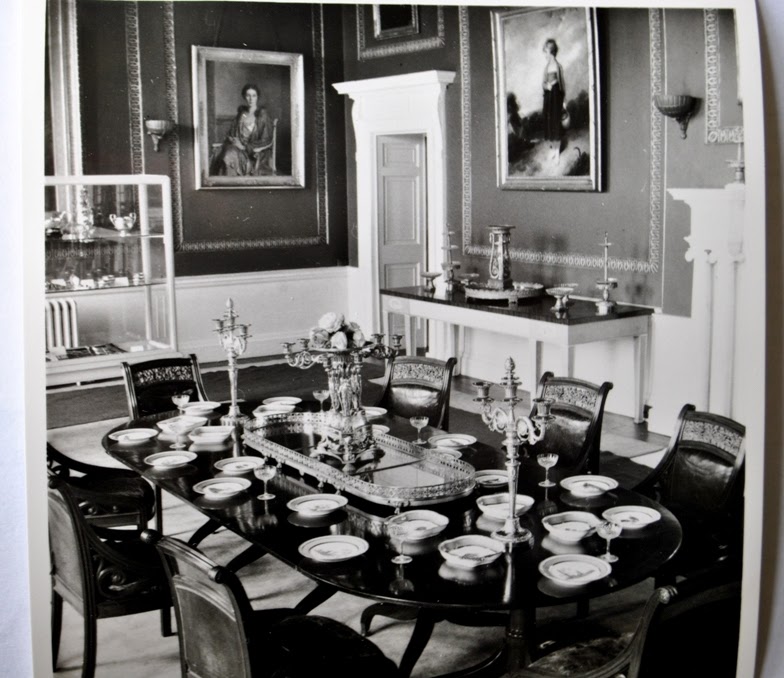
The width and height of the screenshot is (784, 678). Identify the location of radiator. (64, 325).